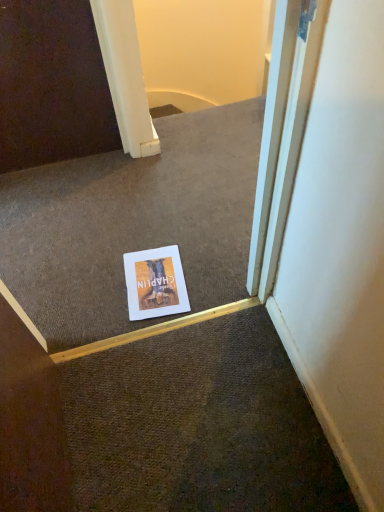
Where is `free spot to the left of white paper at center`? Image resolution: width=384 pixels, height=512 pixels. free spot to the left of white paper at center is located at coordinates (92, 288).